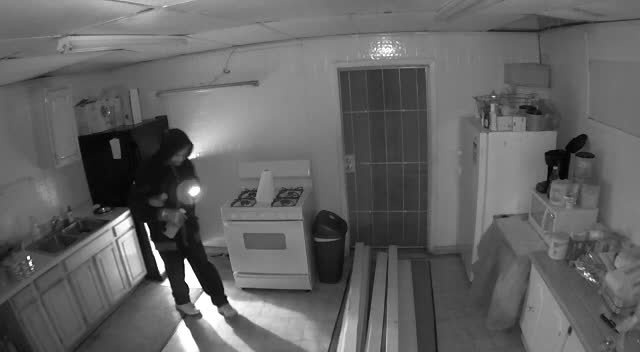
The image size is (640, 352). In order to click on stove burner in this screenshot , I will do `click(290, 192)`, `click(285, 202)`, `click(248, 191)`, `click(246, 201)`.